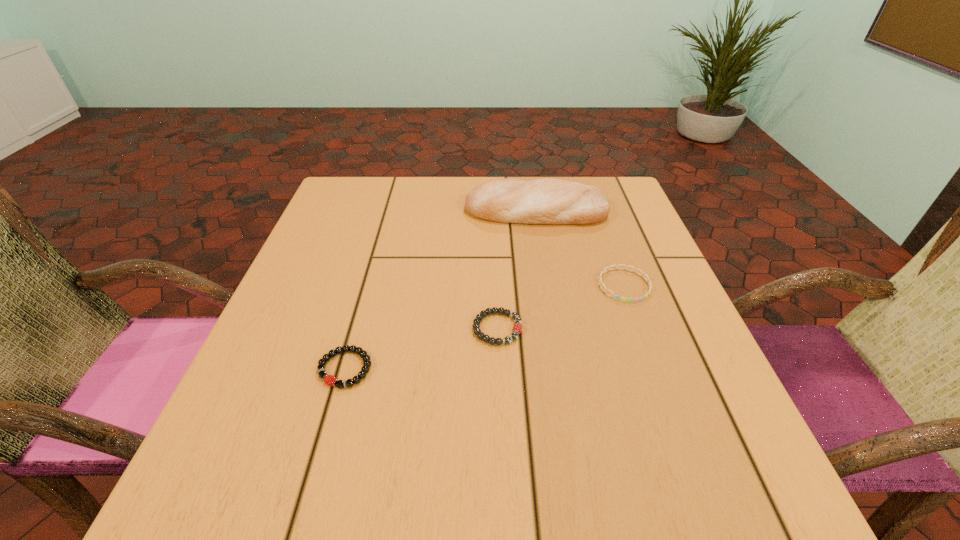
Image resolution: width=960 pixels, height=540 pixels. What are the coordinates of `bread` in the screenshot? It's located at (547, 201).

In order to click on the farthest object in this screenshot , I will do `click(547, 201)`.

Where is `the second bracelet from left to right`? This screenshot has width=960, height=540. the second bracelet from left to right is located at coordinates (517, 328).

Where is `the second nearest object`? the second nearest object is located at coordinates (517, 328).

The width and height of the screenshot is (960, 540). In order to click on the farthest bracelet in this screenshot , I will do `click(600, 283)`.

You are a GUI agent. You are given a task and a screenshot of the screen. Output one action in this format:
    pyautogui.click(x=<x>, y=<y>)
    Task: Click on the rightmost bracelet
    
    Given the screenshot: What is the action you would take?
    pyautogui.click(x=600, y=283)

This screenshot has width=960, height=540. I want to click on the leftmost bracelet, so click(x=330, y=380).

Identify the location of the leftmost object. This screenshot has width=960, height=540. tap(330, 380).

The height and width of the screenshot is (540, 960). What are the coordinates of `free point located 0.110m on the back of the tallest object` in the screenshot? It's located at (530, 176).

Locate an element on the screen. Image resolution: width=960 pixels, height=540 pixels. vacant space located on the back of the second bracelet from right to left is located at coordinates (493, 221).